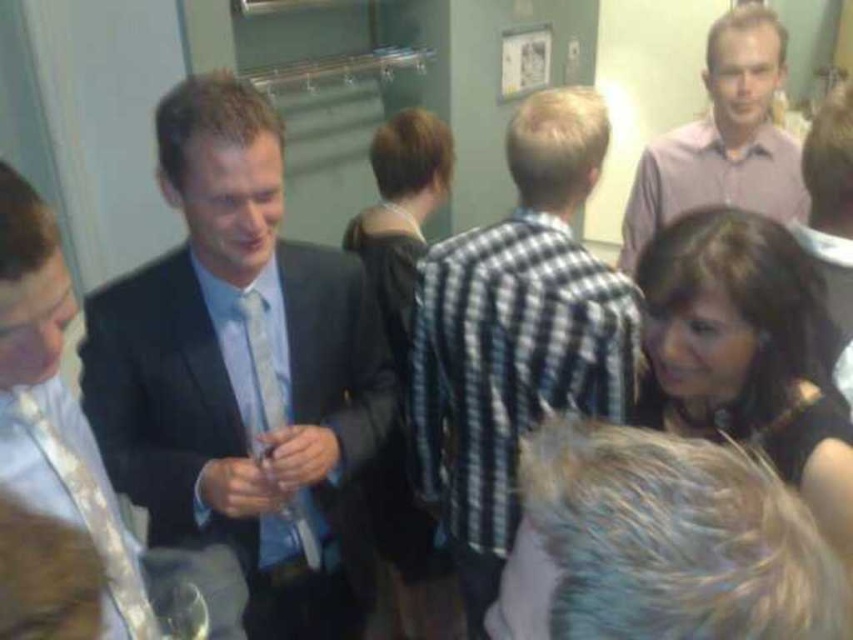
You are standing in the hallway and see the matte black suit at center and the pink shirt at upper right. Which object is taller?

The matte black suit at center is much taller than the pink shirt at upper right.

You are standing in the hallway and want to approach the person wearing the matte black suit at center. According to the coordinates provided, where exactly should you walk towards?

You should walk towards the coordinates point at (242,371) where the matte black suit at center is located.

You are at a social event and notice two people at the center of the scene. The first person is wearing a matte black suit at center, and the second is wearing a checkered fabric shirt at center. From your perspective, which clothing item is closer to you?

The matte black suit at center is closer to you because it is in front of the checkered fabric shirt at center.